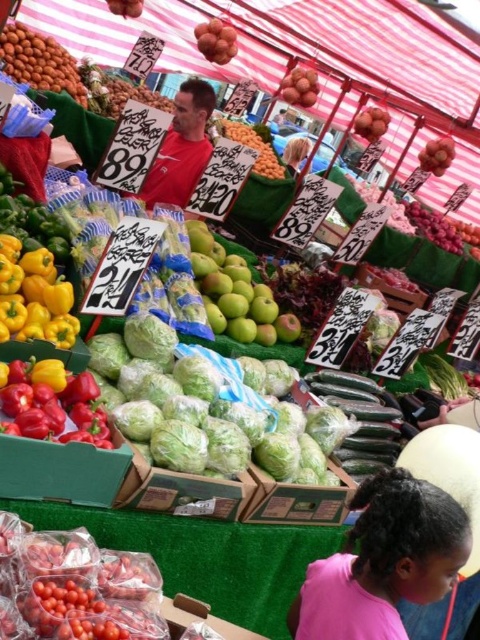
Is shiny brown nuts at upper center positioned in front of ripe orange at upper center?

That is True.

Which is above, shiny brown nuts at upper center or ripe orange at upper center?

Positioned higher is shiny brown nuts at upper center.

Does point (199, 24) lie in front of point (377, 109)?

No, it is not.

You are a GUI agent. You are given a task and a screenshot of the screen. Output one action in this format:
    pyautogui.click(x=<x>, y=<y>)
    Task: Click on the shiny brown nuts at upper center
    The height and width of the screenshot is (640, 480).
    Given the screenshot: What is the action you would take?
    pyautogui.click(x=216, y=40)

Which is more to the right, pink fabric at lower right or blonde hair at upper center?

blonde hair at upper center

Is point (382, 497) closer to viewer compared to point (291, 161)?

That is True.

Is point (447, 564) positioned behind point (302, 154)?

No, (447, 564) is closer to viewer.

Identify the location of pink fabric at lower right. (384, 561).

Between orange matte at upper center and ripe orange at upper center, which one has more height?

orange matte at upper center

Consider the image. Does orange matte at upper center appear over ripe orange at upper center?

No.

Does point (252, 166) come behind point (365, 116)?

That is False.

Where is `orange matte at upper center`? orange matte at upper center is located at coordinates (253, 148).